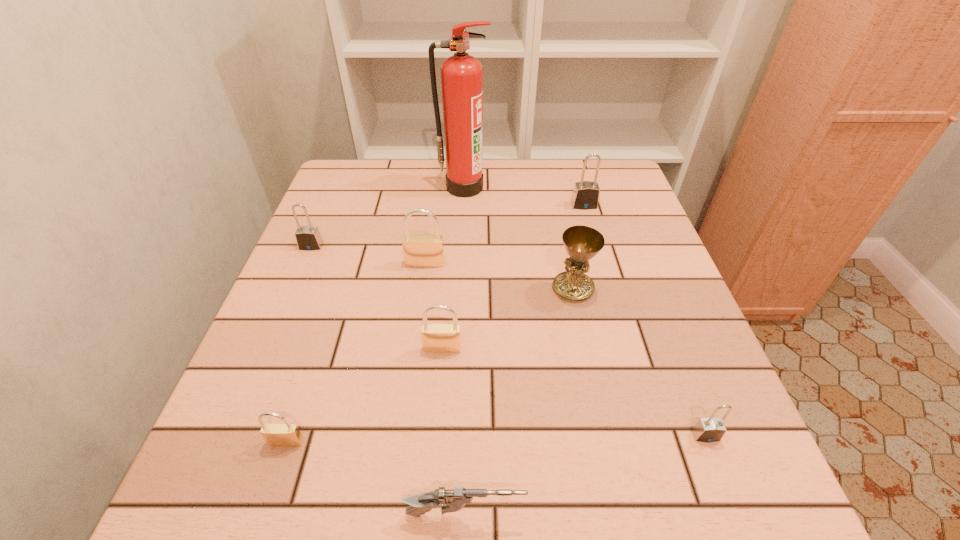
Choose which brass padlock is the second nearest neighbor to the nearest object. Please provide its 2D coordinates. Your answer should be formatted as a tuple, i.e. [(x, y)], where the tuple contains the x and y coordinates of a point satisfying the conditions above.

[(437, 338)]

Find the location of a particular element. The width and height of the screenshot is (960, 540). free space in the image that satisfies the following two spatial constraints: 1. on the shackle of the rightmost padlock; 2. at the barrel of the gun is located at coordinates (736, 515).

In order to click on vacant space that satisfies the following two spatial constraints: 1. on the shackle of the biggest gray padlock; 2. at the barrel of the nearest object in this screenshot , I will do `click(675, 515)`.